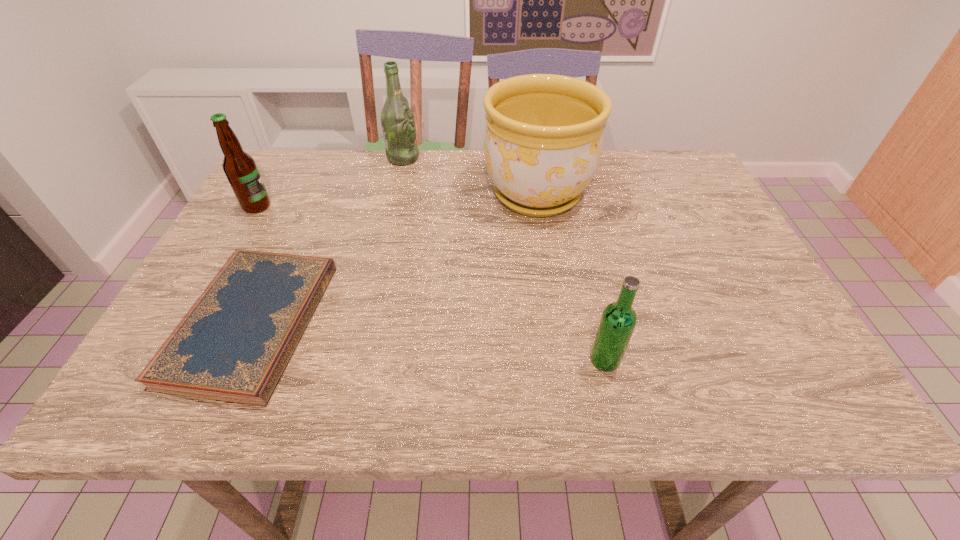
In the image, there is a desktop. What are the coordinates of `free space at the near edge` in the screenshot? It's located at (462, 394).

Where is `vacant space at the right edge`? Image resolution: width=960 pixels, height=540 pixels. vacant space at the right edge is located at coordinates (752, 304).

Locate an element on the screen. This screenshot has width=960, height=540. vacant space at the far left corner of the desktop is located at coordinates (295, 178).

Where is `empty space between the paperback book and the farthest beer bottle`? The image size is (960, 540). empty space between the paperback book and the farthest beer bottle is located at coordinates (327, 240).

The image size is (960, 540). Identify the location of empty space between the second beer bottle from right to left and the shortest object. (327, 240).

The height and width of the screenshot is (540, 960). I want to click on free space that is in between the flowerpot and the second shortest object, so click(571, 277).

Find the location of `vacant space in between the nearest beer bottle and the second beer bottle from right to left`. vacant space in between the nearest beer bottle and the second beer bottle from right to left is located at coordinates (504, 259).

This screenshot has width=960, height=540. I want to click on vacant space that's between the flowerpot and the farthest beer bottle, so click(470, 176).

This screenshot has width=960, height=540. I want to click on vacant region between the leftmost beer bottle and the farthest beer bottle, so click(x=330, y=182).

I want to click on vacant region between the rightmost beer bottle and the leftmost beer bottle, so click(x=431, y=283).